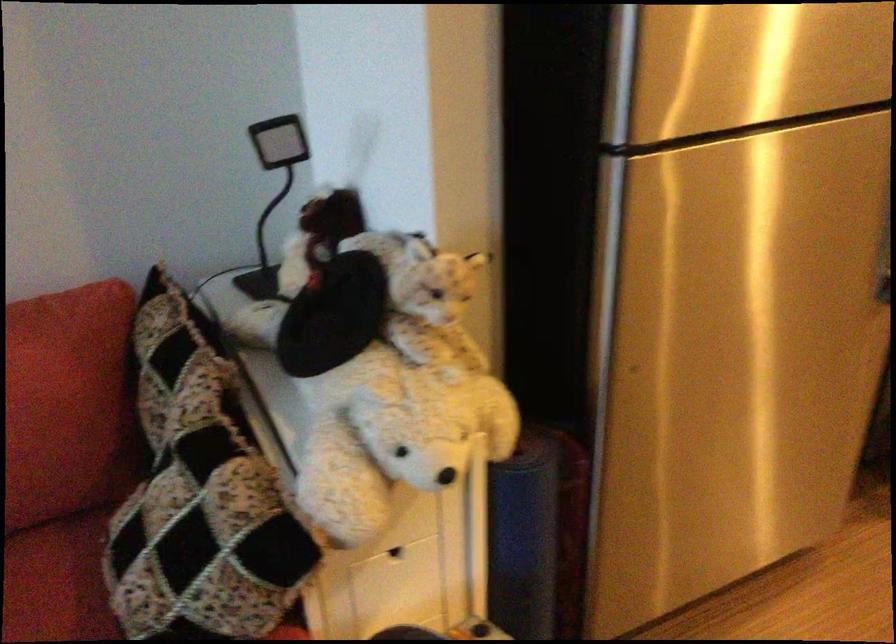
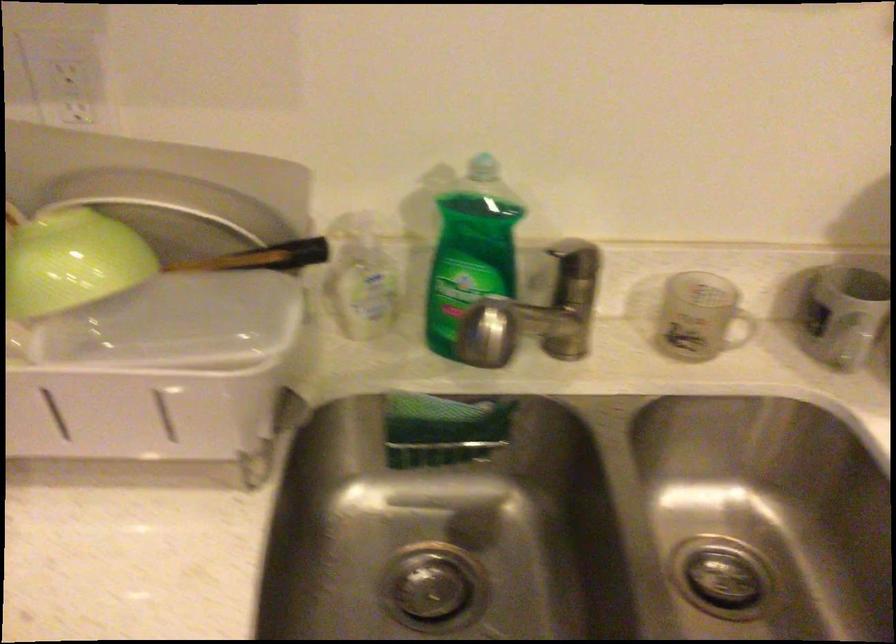
Which direction would the cameraman need to move to produce the second image?

The cameraman walked toward right, forward.